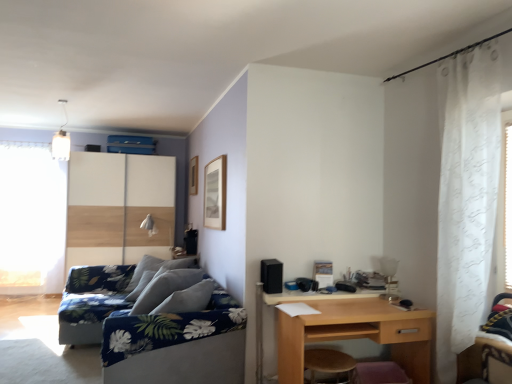
You are a GUI agent. You are given a task and a screenshot of the screen. Output one action in this format:
    pyautogui.click(x=<x>, y=<y>)
    Task: Click on the white sheer curtain at left
    The width and height of the screenshot is (512, 384).
    Given the screenshot: What is the action you would take?
    [x=31, y=218]

What do you see at coordinates (31, 218) in the screenshot? I see `white sheer curtain at left` at bounding box center [31, 218].

Locate an element on the screen. blue floral fabric couch at lower left is located at coordinates (168, 346).

This screenshot has width=512, height=384. What are the coordinates of `light brown wood desk at lower right` in the screenshot? It's located at (356, 334).

Is blue floral fabric couch at lower left further to the viewer compared to light brown wood desk at lower right?

Yes, blue floral fabric couch at lower left is further from the viewer.

Consider the image. From a real-world perspective, which is physically above, blue floral fabric couch at lower left or light brown wood desk at lower right?

From a 3D spatial view, blue floral fabric couch at lower left is above.

Is blue floral fabric couch at lower left not near light brown wood desk at lower right?

No, blue floral fabric couch at lower left is in close proximity to light brown wood desk at lower right.

This screenshot has height=384, width=512. I want to click on desk below the blue floral fabric couch at lower left (from a real-world perspective), so click(356, 334).

From a real-world perspective, relative to wooden stool at lower center, is white sheer curtain at right vertically above or below?

In terms of real-world spatial position, white sheer curtain at right is above wooden stool at lower center.

Is wooden stool at lower center completely or partially inside white sheer curtain at right?

That's incorrect, wooden stool at lower center is not inside white sheer curtain at right.

Is white sheer curtain at right closer to camera compared to wooden stool at lower center?

Yes, it is.

Is white sheer curtain at right aimed at wooden stool at lower center?

No, white sheer curtain at right is not facing towards wooden stool at lower center.

Is wooden sliding door at left at the back of blue floral fabric couch at lower left?

That's not correct — blue floral fabric couch at lower left is not looking away from wooden sliding door at left.

Is blue floral fabric couch at lower left surrounding wooden sliding door at left?

Definitely not — wooden sliding door at left is not inside blue floral fabric couch at lower left.

How much distance is there between blue floral fabric couch at lower left and wooden sliding door at left?

blue floral fabric couch at lower left is 8.80 feet away from wooden sliding door at left.

Consider the image. Is blue floral fabric couch at lower left in front of or behind wooden sliding door at left in the image?

blue floral fabric couch at lower left is in front of wooden sliding door at left.

In the scene shown: Is white sheer curtain at right not close to white sheer curtain at left?

white sheer curtain at right is far away from white sheer curtain at left.

Identify the location of window screen that is on the left side of white sheer curtain at right. (31, 218).

From the image's perspective, is white sheer curtain at right under white sheer curtain at left?

No.

Does white sheer curtain at right have a larger size compared to white sheer curtain at left?

No.

Are blue floral fabric couch at lower left and wooden stool at lower center making contact?

There is a gap between blue floral fabric couch at lower left and wooden stool at lower center.

Visually, is blue floral fabric couch at lower left positioned to the left or to the right of wooden stool at lower center?

blue floral fabric couch at lower left is to the left of wooden stool at lower center.

From the image's perspective, does blue floral fabric couch at lower left appear lower than wooden stool at lower center?

No.

Which is further, (x=11, y=193) or (x=469, y=276)?

Positioned behind is point (x=11, y=193).

Are white sheer curtain at left and white sheer curtain at right beside each other?

No, white sheer curtain at left is not touching white sheer curtain at right.

Is white sheer curtain at right surrounded by white sheer curtain at left?

No.

Is white sheer curtain at left at the left side of white sheer curtain at right?

Indeed, white sheer curtain at left is positioned on the left side of white sheer curtain at right.

Who is bigger, light brown wood desk at lower right or wooden stool at lower center?

Bigger between the two is light brown wood desk at lower right.

How many degrees apart are the facing directions of light brown wood desk at lower right and wooden stool at lower center?

The facing directions of light brown wood desk at lower right and wooden stool at lower center are 0.0969 degrees apart.

Is light brown wood desk at lower right not near wooden stool at lower center?

light brown wood desk at lower right is near wooden stool at lower center, not far away.

Is light brown wood desk at lower right positioned behind wooden stool at lower center?

No, it is in front of wooden stool at lower center.

At what (x,y) coordinates should I click in order to perform the action: click on desk on the right side of blue floral fabric couch at lower left. Please return your answer as a coordinate pair (x, y). The width and height of the screenshot is (512, 384). Looking at the image, I should click on (356, 334).

Locate an element on the screen. The width and height of the screenshot is (512, 384). curtain that appears above the wooden stool at lower center (from the image's perspective) is located at coordinates (466, 198).

Estimate the real-world distances between objects in this image. Which object is closer to wooden sliding door at left, white sheer curtain at left or white sheer curtain at right?

Based on the image, white sheer curtain at left appears to be nearer to wooden sliding door at left.

Based on their spatial positions, is white sheer curtain at left or wooden sliding door at left closer to light brown wood desk at lower right?

wooden sliding door at left is positioned closer to the anchor light brown wood desk at lower right.

Looking at this image, which object lies further to the anchor point white sheer curtain at right, white sheer curtain at left or wooden sliding door at left?

white sheer curtain at left.

Based on their spatial positions, is wooden sliding door at left or white sheer curtain at right further from light brown wood desk at lower right?

wooden sliding door at left is positioned further to the anchor light brown wood desk at lower right.

When comparing their distances from white sheer curtain at right, does blue floral fabric couch at lower left or light brown wood desk at lower right seem further?

The object further to white sheer curtain at right is blue floral fabric couch at lower left.

When comparing their distances from wooden stool at lower center, does white sheer curtain at left or white sheer curtain at right seem further?

white sheer curtain at left.

Which object lies nearer to the anchor point wooden stool at lower center, white sheer curtain at right or light brown wood desk at lower right?

Among the two, light brown wood desk at lower right is located nearer to wooden stool at lower center.

When comparing their distances from wooden sliding door at left, does white sheer curtain at right or white sheer curtain at left seem further?

white sheer curtain at right is further to wooden sliding door at left.

Locate an element on the screen. The width and height of the screenshot is (512, 384). stool between blue floral fabric couch at lower left and white sheer curtain at right is located at coordinates (328, 362).

Find the location of a particular element. This screenshot has height=384, width=512. studio couch between white sheer curtain at left and white sheer curtain at right is located at coordinates (168, 346).

At what (x,y) coordinates should I click in order to perform the action: click on studio couch situated between white sheer curtain at left and wooden stool at lower center from left to right. Please return your answer as a coordinate pair (x, y). The height and width of the screenshot is (384, 512). Looking at the image, I should click on (168, 346).

Where is `desk between blue floral fabric couch at lower left and white sheer curtain at right in the horizontal direction`? Image resolution: width=512 pixels, height=384 pixels. desk between blue floral fabric couch at lower left and white sheer curtain at right in the horizontal direction is located at coordinates (356, 334).